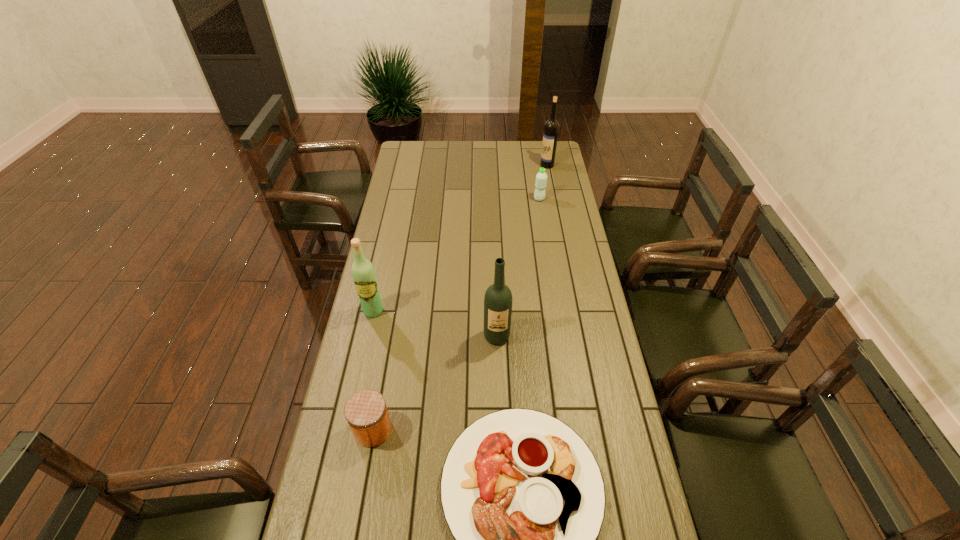
Identify the location of vacant space located on the label of the rightmost wine bottle. This screenshot has height=540, width=960. (474, 165).

Image resolution: width=960 pixels, height=540 pixels. Find the location of `vacant space located on the label of the rightmost wine bottle`. vacant space located on the label of the rightmost wine bottle is located at coordinates (471, 165).

This screenshot has height=540, width=960. In order to click on vacant space located 0.160m on the labeled side of the third nearest object in this screenshot , I will do `click(498, 389)`.

Locate an element on the screen. free space located on the front-facing side of the second nearest wine bottle is located at coordinates (370, 330).

Locate an element on the screen. This screenshot has width=960, height=540. free space located on the right of the third shortest object is located at coordinates (566, 199).

Where is `vacant space situated 0.390m on the right of the second shortest object`? vacant space situated 0.390m on the right of the second shortest object is located at coordinates (526, 429).

You are a GUI agent. You are given a task and a screenshot of the screen. Output one action in this format:
    pyautogui.click(x=<x>, y=<y>)
    Task: Click on the object that is positioned at the far edge
    
    Given the screenshot: What is the action you would take?
    pyautogui.click(x=551, y=128)

Where is `wine bottle at the left edge`? wine bottle at the left edge is located at coordinates (363, 273).

What are the coordinates of `jar present at the left edge` in the screenshot? It's located at (366, 412).

The height and width of the screenshot is (540, 960). I want to click on wine bottle that is at the right edge, so click(x=551, y=128).